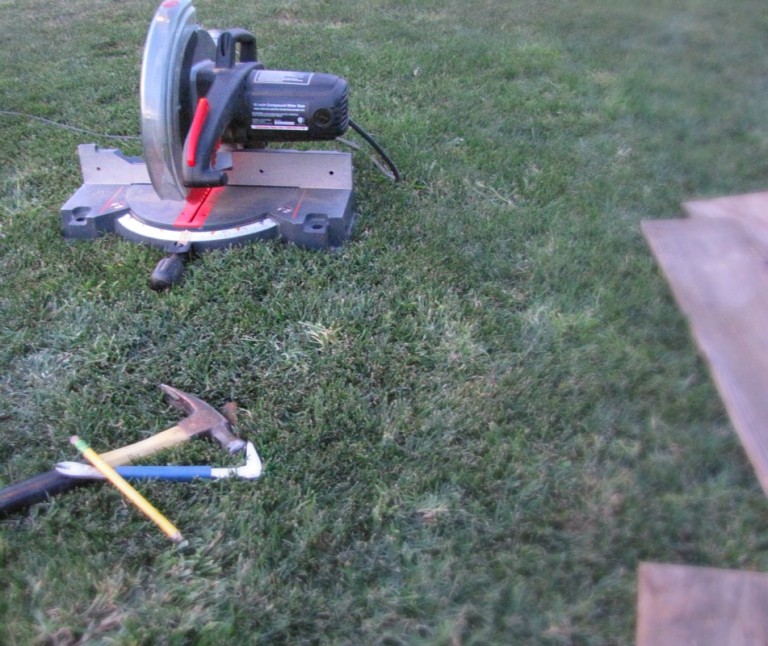
Image resolution: width=768 pixels, height=646 pixels. I want to click on handle, so click(x=245, y=37).